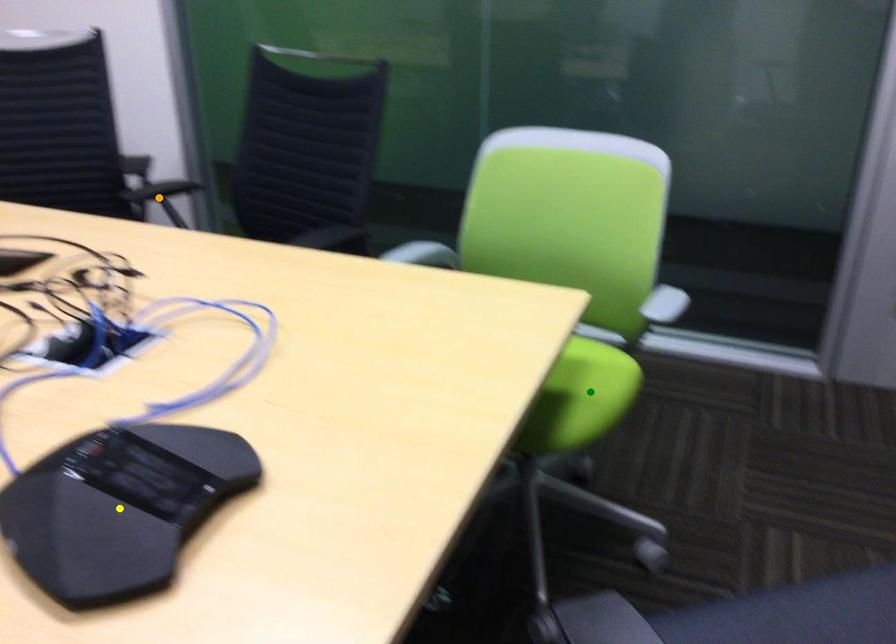
Order these from nearest to farthest:
1. green point
2. orange point
3. yellow point

orange point → green point → yellow point